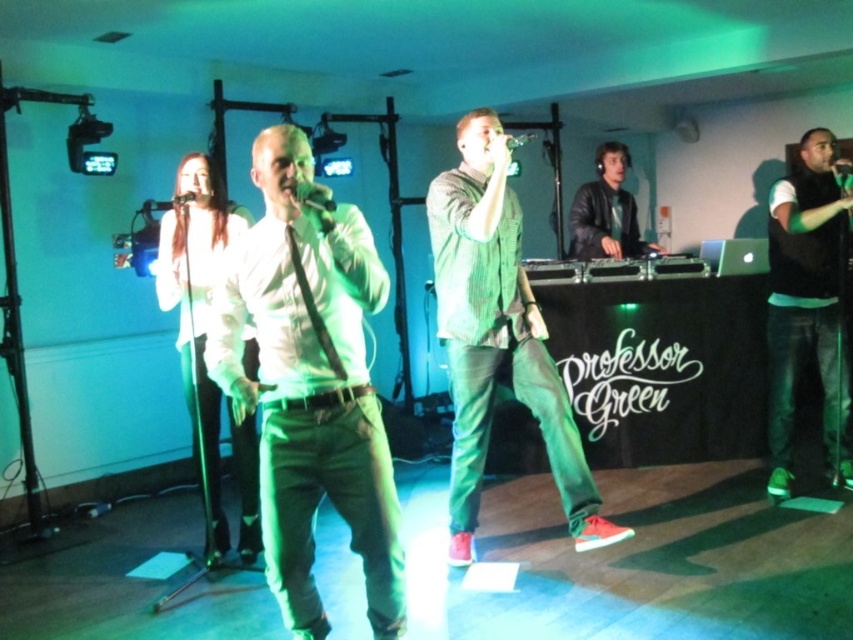
You are a photographer at the concert. You want to take a photo of the metallic silver microphone at upper center and the metallic silver microphone at center. Which microphone is closer to you?

The metallic silver microphone at upper center is closer to you than the metallic silver microphone at center.

You are a stagehand who needs to place a new microphone stand at the exact same 2D location as the metallic silver microphone at upper center. What coordinates should you use?

The coordinates for the metallic silver microphone at upper center are at point (x=169, y=202), so you should place the new microphone stand at those coordinates.